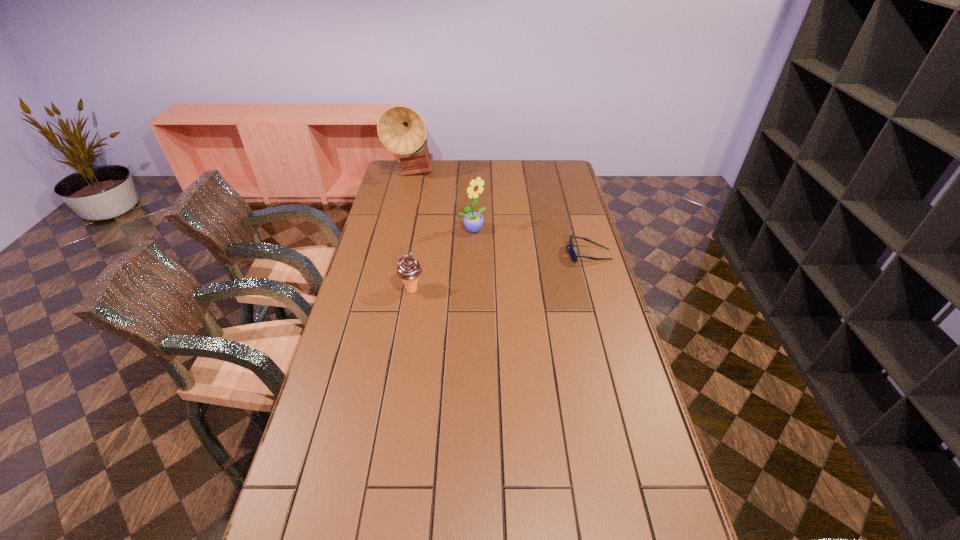
The height and width of the screenshot is (540, 960). I want to click on free location located on the front-facing side of the second nearest object, so (468, 254).

Locate an element on the screen. free space located 0.330m on the front-facing side of the second nearest object is located at coordinates (480, 254).

Identify the location of free spot located 0.330m on the front-facing side of the second tallest object. Image resolution: width=960 pixels, height=540 pixels. tap(543, 274).

Where is `free space located on the front-facing side of the second tallest object`? This screenshot has width=960, height=540. free space located on the front-facing side of the second tallest object is located at coordinates (548, 277).

You are a GUI agent. You are given a task and a screenshot of the screen. Output one action in this format:
    pyautogui.click(x=<x>, y=<y>)
    Task: Click on the free point located 0.060m on the front-facing side of the second tallest object
    The width and height of the screenshot is (960, 540).
    Given the screenshot: What is the action you would take?
    pyautogui.click(x=492, y=241)

Image resolution: width=960 pixels, height=540 pixels. In order to click on vacant region located on the horn of the farthest object in this screenshot , I will do `click(450, 214)`.

Image resolution: width=960 pixels, height=540 pixels. I want to click on vacant space located 0.150m on the horn of the farthest object, so click(435, 198).

At what (x,y) coordinates should I click in order to perform the action: click on vacant space located on the horn of the farthest object. Please return your answer as a coordinate pair (x, y). The image size is (960, 540). Looking at the image, I should click on (437, 200).

I want to click on object that is at the far edge, so click(401, 129).

You are a GUI agent. You are given a task and a screenshot of the screen. Output one action in this format:
    pyautogui.click(x=<x>, y=<y>)
    Task: Click on the object at the left edge
    
    Given the screenshot: What is the action you would take?
    pyautogui.click(x=401, y=129)